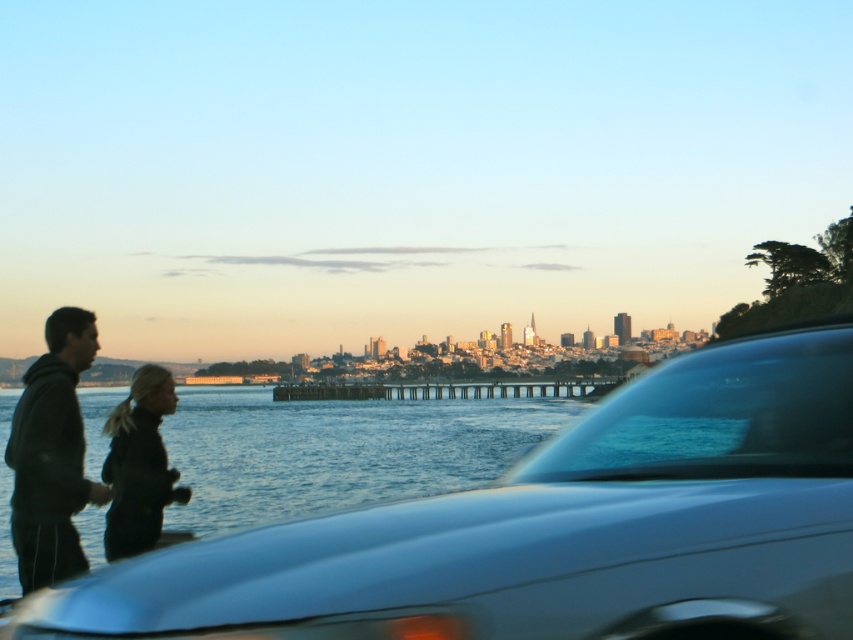
Question: Which point is closer to the camera taking this photo?

Choices:
 (A) (310, 532)
 (B) (39, 400)
 (C) (115, 458)

Answer: (A)

Question: Which point is farther from the camera taking this photo?

Choices:
 (A) (286, 611)
 (B) (55, 410)

Answer: (B)

Question: Considering the relative positions of black matte jacket at left and black matte jacket at lower left in the image provided, where is black matte jacket at left located with respect to black matte jacket at lower left?

Choices:
 (A) left
 (B) right

Answer: (A)

Question: Which point is closer to the camera taking this photo?

Choices:
 (A) (131, 445)
 (B) (28, 497)
 (C) (503, 560)

Answer: (C)

Question: Is black matte jacket at left to the left of black matte jacket at lower left from the viewer's perspective?

Choices:
 (A) no
 (B) yes

Answer: (B)

Question: Can you confirm if satin silver car at center is positioned above black matte jacket at left?

Choices:
 (A) no
 (B) yes

Answer: (B)